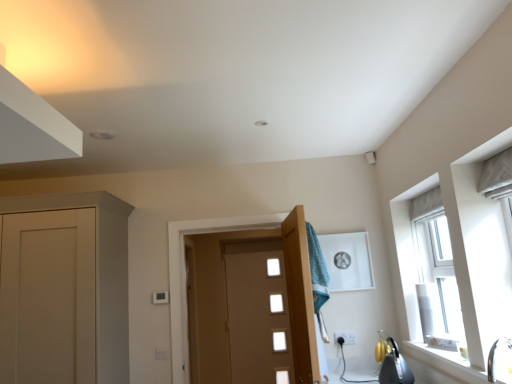
Question: Is teal fabric towel at center bigger or smaller than metallic silver kettle at lower right?

Choices:
 (A) big
 (B) small

Answer: (A)

Question: Does point (323, 329) appear closer or farther from the camera than point (413, 377)?

Choices:
 (A) farther
 (B) closer

Answer: (A)

Question: Which of these objects is positioned closest to the white plastic electric outlet at lower center?

Choices:
 (A) metallic silver kettle at lower right
 (B) wooden door at center, the second door from the back
 (C) white ceramic window sill at lower right
 (D) teal fabric towel at center
 (E) white glossy sink at lower right

Answer: (A)

Question: Considering the real-world distances, which object is closest to the wooden door at center, the second door from the back?

Choices:
 (A) matte brown door at center, arranged as the first door when viewed from the back
 (B) metallic silver kettle at lower right
 (C) white glossy sink at lower right
 (D) white plastic electric outlet at lower center
 (E) teal fabric towel at center

Answer: (E)